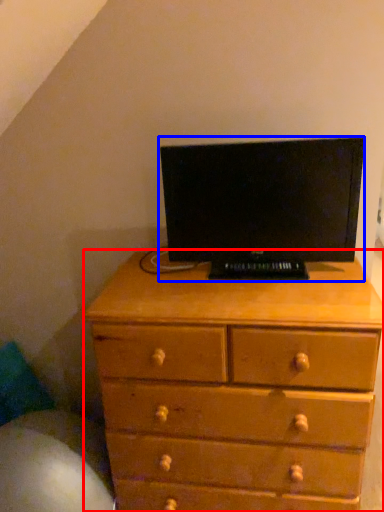
Question: Which object is closer to the camera taking this photo, chest of drawers (highlighted by a red box) or computer monitor (highlighted by a blue box)?

Choices:
 (A) chest of drawers
 (B) computer monitor

Answer: (A)